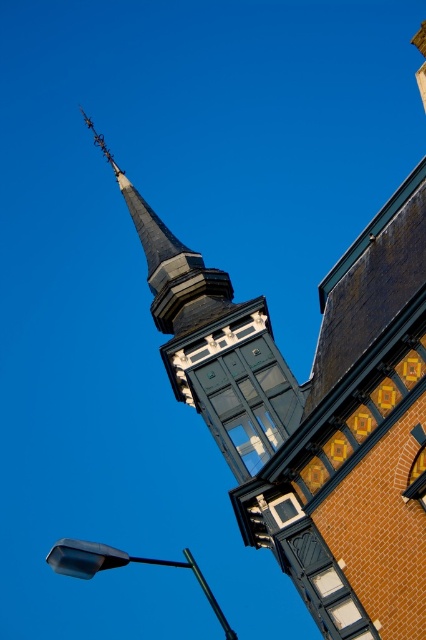
Which is above, dark gray slate steeple at upper left or matte black streetlight at lower left?

dark gray slate steeple at upper left is higher up.

The image size is (426, 640). What do you see at coordinates (213, 342) in the screenshot?
I see `dark gray slate steeple at upper left` at bounding box center [213, 342].

Is point (239, 348) positioned after point (88, 560)?

Yes, it is behind point (88, 560).

Where is `dark gray slate steeple at upper left`? dark gray slate steeple at upper left is located at coordinates (213, 342).